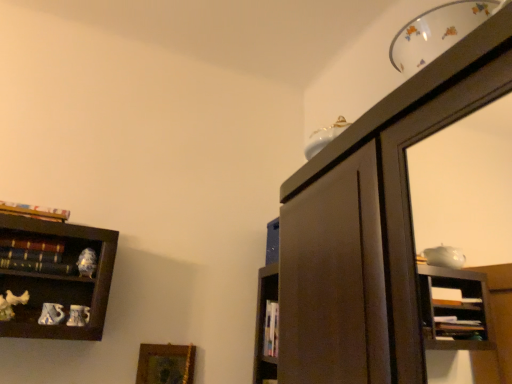
The height and width of the screenshot is (384, 512). I want to click on gold-framed picture at lower left, so click(165, 364).

I want to click on hardcover book at upper left, positioned as the first book in top-to-bottom order, so click(34, 211).

Find the location of a particular element. This screenshot has width=512, height=384. gold-framed picture at lower left is located at coordinates (165, 364).

Could you measure the distance between hardcover books at left, positioned as the 1th book in bottom-to-top order, and gold-framed picture at lower left?

23.36 inches.

From a real-world perspective, is hardcover books at left, positioned as the 1th book in bottom-to-top order, on top of gold-framed picture at lower left?

Indeed, from a real-world perspective, hardcover books at left, positioned as the 1th book in bottom-to-top order, stands above gold-framed picture at lower left.

From the image's perspective, who appears lower, hardcover books at left, positioned as the 1th book in bottom-to-top order, or gold-framed picture at lower left?

From the image's view, gold-framed picture at lower left is below.

Is hardcover books at left, the 2th book when ordered from top to bottom, located outside gold-framed picture at lower left?

Indeed, hardcover books at left, the 2th book when ordered from top to bottom, is completely outside gold-framed picture at lower left.

Consider the image. Which is more to the right, gold-framed picture at lower left or hardcover books at left, the 2th book when ordered from top to bottom?

From the viewer's perspective, gold-framed picture at lower left appears more on the right side.

Locate an element on the screen. This screenshot has height=384, width=512. picture frame that appears below the hardcover books at left, positioned as the 1th book in bottom-to-top order (from a real-world perspective) is located at coordinates (165, 364).

From the image's perspective, does gold-framed picture at lower left appear higher than hardcover books at left, the 2th book when ordered from top to bottom?

No, from the image's perspective, gold-framed picture at lower left is not on top of hardcover books at left, the 2th book when ordered from top to bottom.

Is hardcover books at left, positioned as the 1th book in bottom-to-top order, not near hardcover book at upper left, which is the 2th book from bottom to top?

No.

From the picture: In the image, is hardcover books at left, the 2th book when ordered from top to bottom, on the left side or the right side of hardcover book at upper left, which is the 2th book from bottom to top?

Based on their positions, hardcover books at left, the 2th book when ordered from top to bottom, is located to the right of hardcover book at upper left, which is the 2th book from bottom to top.

At what (x,y) coordinates should I click in order to perform the action: click on book that is under the hardcover book at upper left, positioned as the first book in top-to-bottom order (from a real-world perspective). Please return your answer as a coordinate pair (x, y). Looking at the image, I should click on (38, 267).

Which of these two, hardcover book at upper left, which is the 2th book from bottom to top, or gold-framed picture at lower left, stands taller?

gold-framed picture at lower left.

Which of these two, hardcover book at upper left, positioned as the first book in top-to-bottom order, or gold-framed picture at lower left, is bigger?

With larger size is gold-framed picture at lower left.

Where is `picture frame lying on the right of hardcover book at upper left, positioned as the first book in top-to-bottom order`? picture frame lying on the right of hardcover book at upper left, positioned as the first book in top-to-bottom order is located at coordinates (165, 364).

In the scene shown: Which object is closer to the camera taking this photo, hardcover book at upper left, which is the 2th book from bottom to top, or gold-framed picture at lower left?

hardcover book at upper left, which is the 2th book from bottom to top, is in front.

Could you tell me if gold-framed picture at lower left is turned towards hardcover book at upper left, which is the 2th book from bottom to top?

No.

From a real-world perspective, is gold-framed picture at lower left above or below hardcover book at upper left, positioned as the first book in top-to-bottom order?

In terms of real-world spatial position, gold-framed picture at lower left is below hardcover book at upper left, positioned as the first book in top-to-bottom order.

In the scene shown: Considering the sizes of objects gold-framed picture at lower left and hardcover book at upper left, positioned as the first book in top-to-bottom order, in the image provided, who is thinner, gold-framed picture at lower left or hardcover book at upper left, positioned as the first book in top-to-bottom order,?

gold-framed picture at lower left is thinner.

Considering the positions of objects hardcover book at upper left, which is the 2th book from bottom to top, and hardcover books at left, the 2th book when ordered from top to bottom, in the image provided, who is more to the left, hardcover book at upper left, which is the 2th book from bottom to top, or hardcover books at left, the 2th book when ordered from top to bottom,?

Positioned to the left is hardcover book at upper left, which is the 2th book from bottom to top.

From the image's perspective, is hardcover book at upper left, positioned as the first book in top-to-bottom order, above or below hardcover books at left, positioned as the 1th book in bottom-to-top order?

Clearly, from the image's perspective, hardcover book at upper left, positioned as the first book in top-to-bottom order, is above hardcover books at left, positioned as the 1th book in bottom-to-top order.

Looking at this image, which of these two, hardcover book at upper left, positioned as the first book in top-to-bottom order, or hardcover books at left, the 2th book when ordered from top to bottom, stands shorter?

hardcover books at left, the 2th book when ordered from top to bottom, is shorter.

This screenshot has width=512, height=384. I want to click on picture frame that appears below the hardcover books at left, the 2th book when ordered from top to bottom (from a real-world perspective), so click(x=165, y=364).

The height and width of the screenshot is (384, 512). Identify the location of picture frame that appears on the right of hardcover books at left, the 2th book when ordered from top to bottom. (165, 364).

Based on their spatial positions, is gold-framed picture at lower left or hardcover book at upper left, which is the 2th book from bottom to top, further from hardcover books at left, positioned as the 1th book in bottom-to-top order?

gold-framed picture at lower left is further to hardcover books at left, positioned as the 1th book in bottom-to-top order.

When comparing their distances from gold-framed picture at lower left, does hardcover book at upper left, which is the 2th book from bottom to top, or hardcover books at left, positioned as the 1th book in bottom-to-top order, seem further?

Among the two, hardcover book at upper left, which is the 2th book from bottom to top, is located further to gold-framed picture at lower left.

From the image, which object appears to be nearer to hardcover book at upper left, which is the 2th book from bottom to top, gold-framed picture at lower left or hardcover books at left, positioned as the 1th book in bottom-to-top order?

hardcover books at left, positioned as the 1th book in bottom-to-top order, is positioned closer to the anchor hardcover book at upper left, which is the 2th book from bottom to top.

Looking at the image, which one is located further to hardcover books at left, the 2th book when ordered from top to bottom, hardcover book at upper left, which is the 2th book from bottom to top, or gold-framed picture at lower left?

Based on the image, gold-framed picture at lower left appears to be further to hardcover books at left, the 2th book when ordered from top to bottom.

Based on their spatial positions, is hardcover books at left, positioned as the 1th book in bottom-to-top order, or gold-framed picture at lower left further from hardcover book at upper left, which is the 2th book from bottom to top?

Based on the image, gold-framed picture at lower left appears to be further to hardcover book at upper left, which is the 2th book from bottom to top.

Which object lies nearer to the anchor point gold-framed picture at lower left, hardcover books at left, positioned as the 1th book in bottom-to-top order, or hardcover book at upper left, positioned as the first book in top-to-bottom order?

hardcover books at left, positioned as the 1th book in bottom-to-top order, is positioned closer to the anchor gold-framed picture at lower left.

Where is `book between hardcover book at upper left, positioned as the first book in top-to-bottom order, and gold-framed picture at lower left, in the vertical direction`? This screenshot has width=512, height=384. book between hardcover book at upper left, positioned as the first book in top-to-bottom order, and gold-framed picture at lower left, in the vertical direction is located at coordinates (38, 267).